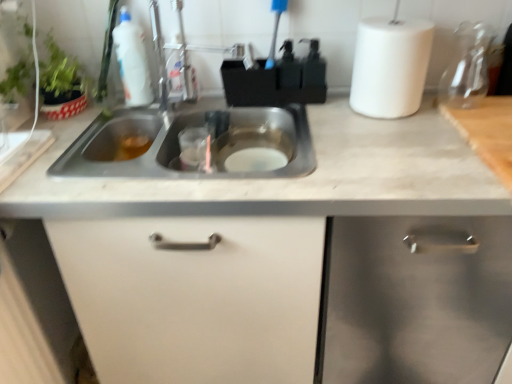
Question: Is white matte cabinet at center, placed as the 1th cabinetry when sorted from left to right, placed right next to white matte cabinet at right, the 2th cabinetry in the left-to-right sequence?

Choices:
 (A) no
 (B) yes

Answer: (A)

Question: Considering the relative sizes of white matte cabinet at center, marked as the 2th cabinetry in a right-to-left arrangement, and white matte cabinet at right, the 2th cabinetry in the left-to-right sequence, in the image provided, is white matte cabinet at center, marked as the 2th cabinetry in a right-to-left arrangement, bigger than white matte cabinet at right, the 2th cabinetry in the left-to-right sequence,?

Choices:
 (A) no
 (B) yes

Answer: (B)

Question: From the image's perspective, is white matte cabinet at center, placed as the 1th cabinetry when sorted from left to right, on top of white matte cabinet at right, which is the 1th cabinetry in right-to-left order?

Choices:
 (A) yes
 (B) no

Answer: (B)

Question: Does white matte cabinet at center, marked as the 2th cabinetry in a right-to-left arrangement, have a greater width compared to white matte cabinet at right, which is the 1th cabinetry in right-to-left order?

Choices:
 (A) yes
 (B) no

Answer: (B)

Question: Considering the relative positions of white matte cabinet at center, placed as the 1th cabinetry when sorted from left to right, and white matte cabinet at right, the 2th cabinetry in the left-to-right sequence, in the image provided, is white matte cabinet at center, placed as the 1th cabinetry when sorted from left to right, to the right of white matte cabinet at right, the 2th cabinetry in the left-to-right sequence, from the viewer's perspective?

Choices:
 (A) no
 (B) yes

Answer: (A)

Question: Is point (143, 336) closer or farther from the camera than point (248, 124)?

Choices:
 (A) closer
 (B) farther

Answer: (A)

Question: From a real-world perspective, is white matte cabinet at center, marked as the 2th cabinetry in a right-to-left arrangement, above or below stainless steel sink at center?

Choices:
 (A) below
 (B) above

Answer: (A)

Question: Which is correct: white matte cabinet at center, marked as the 2th cabinetry in a right-to-left arrangement, is inside stainless steel sink at center, or outside of it?

Choices:
 (A) inside
 (B) outside

Answer: (B)

Question: Is white matte cabinet at center, placed as the 1th cabinetry when sorted from left to right, bigger or smaller than stainless steel sink at center?

Choices:
 (A) small
 (B) big

Answer: (B)

Question: Considering the positions of white matte paper towel at upper right and white matte cabinet at center, placed as the 1th cabinetry when sorted from left to right, in the image, is white matte paper towel at upper right taller or shorter than white matte cabinet at center, placed as the 1th cabinetry when sorted from left to right,?

Choices:
 (A) tall
 (B) short

Answer: (B)

Question: From a real-world perspective, is white matte paper towel at upper right physically located above or below white matte cabinet at center, placed as the 1th cabinetry when sorted from left to right?

Choices:
 (A) below
 (B) above

Answer: (B)

Question: From the image's perspective, relative to white matte cabinet at center, marked as the 2th cabinetry in a right-to-left arrangement, is white matte paper towel at upper right above or below?

Choices:
 (A) above
 (B) below

Answer: (A)

Question: Does point click(x=356, y=33) appear closer or farther from the camera than point click(x=205, y=246)?

Choices:
 (A) closer
 (B) farther

Answer: (B)

Question: Considering the positions of point (382, 87) and point (122, 82), is point (382, 87) closer or farther from the camera than point (122, 82)?

Choices:
 (A) farther
 (B) closer

Answer: (B)

Question: From a real-world perspective, is white matte paper towel at upper right physically located above or below white plastic bottle at upper left?

Choices:
 (A) below
 (B) above

Answer: (B)